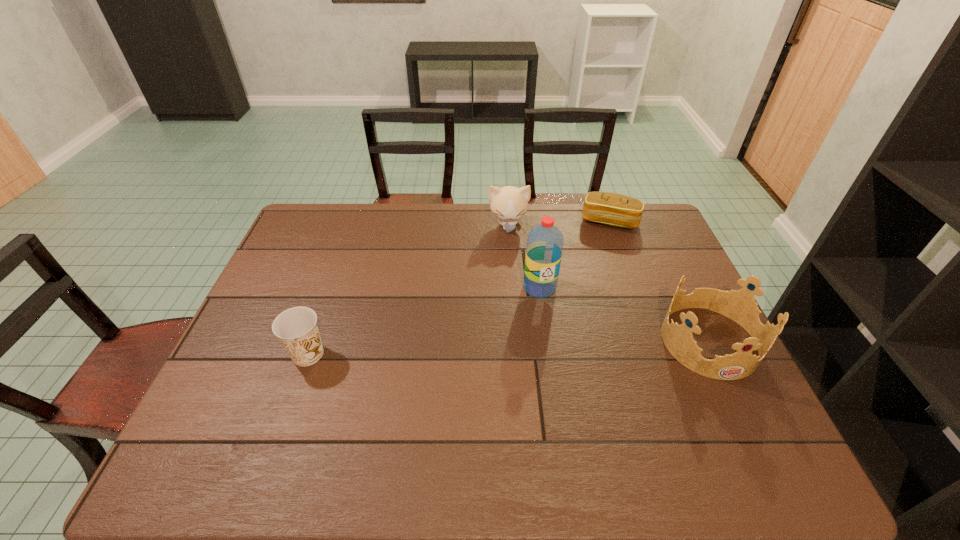
Identify the location of free space that is in between the tiara and the water bottle. The width and height of the screenshot is (960, 540). (624, 314).

Where is `vacant area between the tallest object and the clutch bag`? Image resolution: width=960 pixels, height=540 pixels. vacant area between the tallest object and the clutch bag is located at coordinates (574, 254).

The height and width of the screenshot is (540, 960). What are the coordinates of `vacant space that is in between the tiara and the Dixie cup` in the screenshot? It's located at (508, 347).

Find the location of `vacant region between the tiara and the tallest object`. vacant region between the tiara and the tallest object is located at coordinates (624, 314).

Find the location of a particular element. free space between the shortest object and the Dixie cup is located at coordinates (459, 288).

The width and height of the screenshot is (960, 540). I want to click on vacant space in between the kitten and the third nearest object, so click(x=524, y=256).

Find the location of a particular element. This screenshot has height=540, width=960. free spot between the tiara and the water bottle is located at coordinates (624, 314).

I want to click on object that is the second closest to the Dixie cup, so click(509, 203).

Find the location of a particular element. This screenshot has height=540, width=960. object that stands as the closest to the clutch bag is located at coordinates (509, 203).

Locate an element on the screen. Image resolution: width=960 pixels, height=540 pixels. free location that satisfies the following two spatial constraints: 1. on the back side of the shortest object; 2. on the left side of the tallest object is located at coordinates (530, 221).